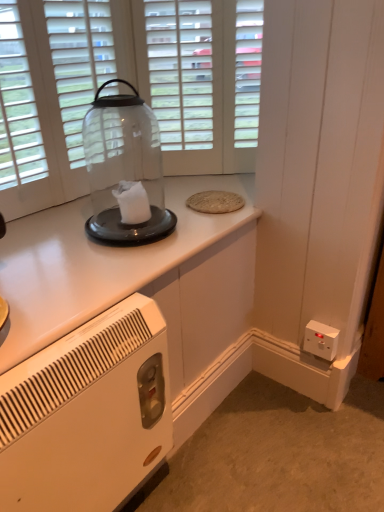
Image resolution: width=384 pixels, height=512 pixels. I want to click on unoccupied region to the right of transparent glass jar at center, so click(200, 225).